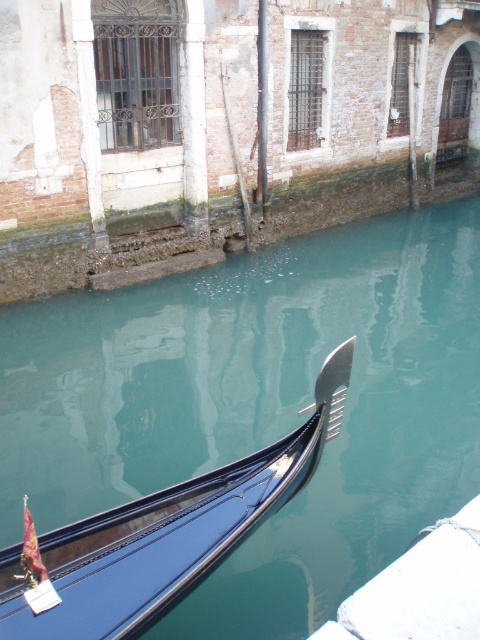
Question: Is glossy teal water at center further to camera compared to shiny black gondola at lower left?

Choices:
 (A) yes
 (B) no

Answer: (A)

Question: Which of the following is the farthest from the observer?

Choices:
 (A) (48, 572)
 (B) (176, 333)

Answer: (B)

Question: Does glossy teal water at center appear under shiny black gondola at lower left?

Choices:
 (A) no
 (B) yes

Answer: (A)

Question: Can you confirm if glossy teal water at center is smaller than shiny black gondola at lower left?

Choices:
 (A) no
 (B) yes

Answer: (A)